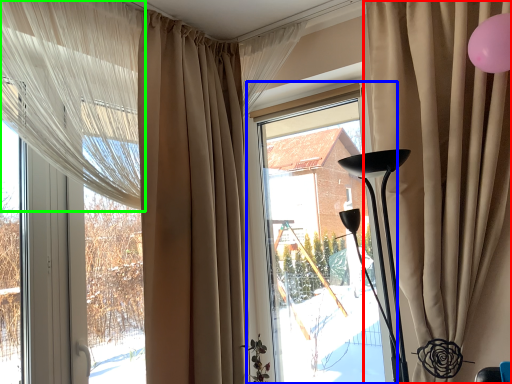
Question: Considering the real-world distances, which object is closest to curtain (highlighted by a red box)? window (highlighted by a blue box) or curtain (highlighted by a green box).

Choices:
 (A) window
 (B) curtain

Answer: (A)